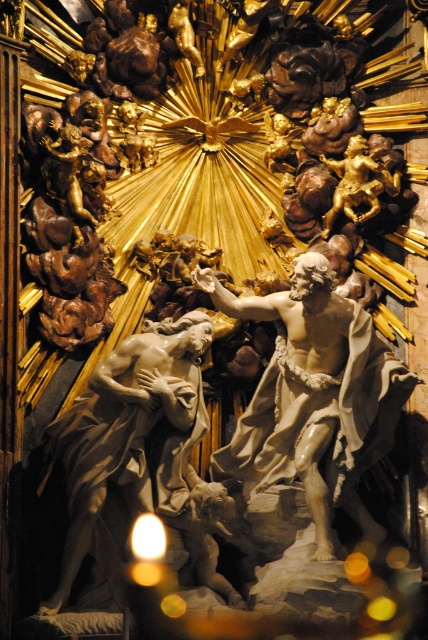
Looking at this image, who is positioned more to the left, white marble statue at center or matte white statue at center?

matte white statue at center is more to the left.

Does white marble statue at center have a lesser width compared to matte white statue at center?

No.

Between point (308, 282) and point (189, 337), which one is positioned behind?

The point (189, 337) is behind.

Locate an element on the screen. The image size is (428, 640). white marble statue at center is located at coordinates (314, 397).